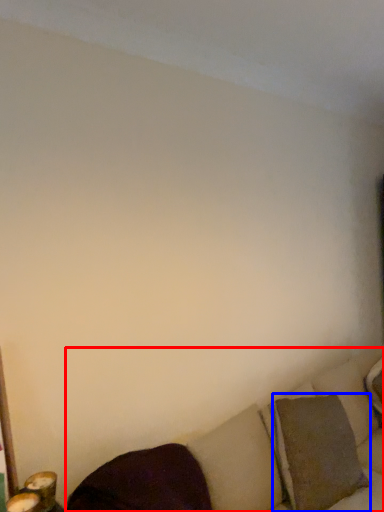
Question: Which point is further to the camera, studio couch (highlighted by a red box) or pillow (highlighted by a blue box)?

Choices:
 (A) studio couch
 (B) pillow

Answer: (B)